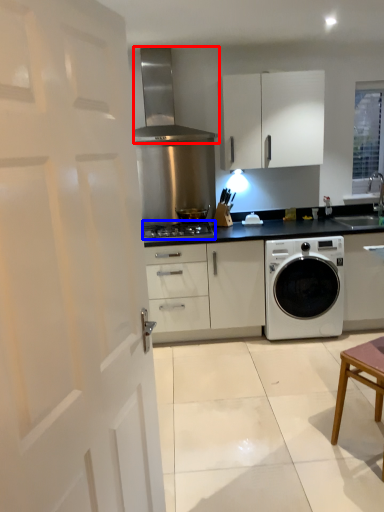
Question: Among these objects, which one is nearest to the camera, home appliance (highlighted by a red box) or gas stove (highlighted by a blue box)?

Choices:
 (A) home appliance
 (B) gas stove

Answer: (A)